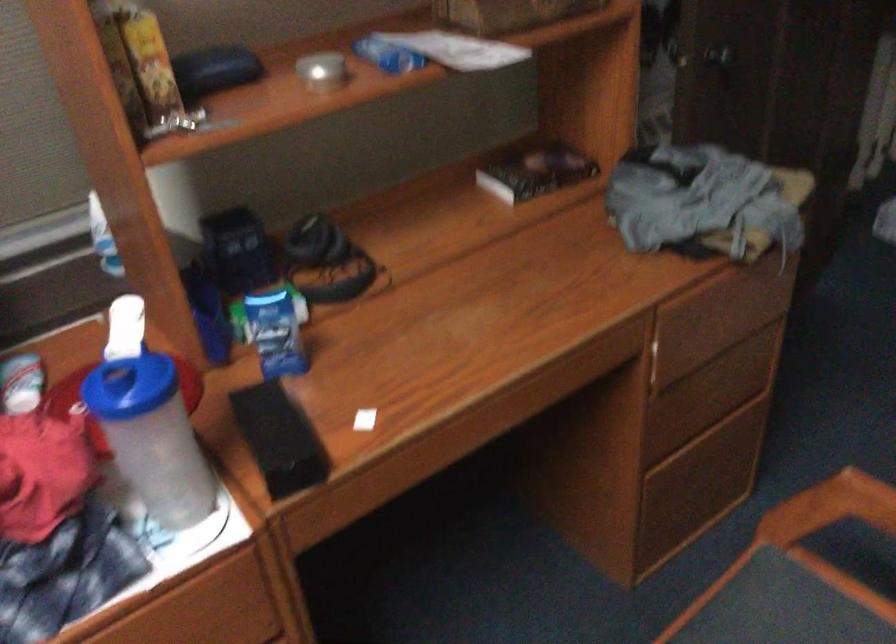
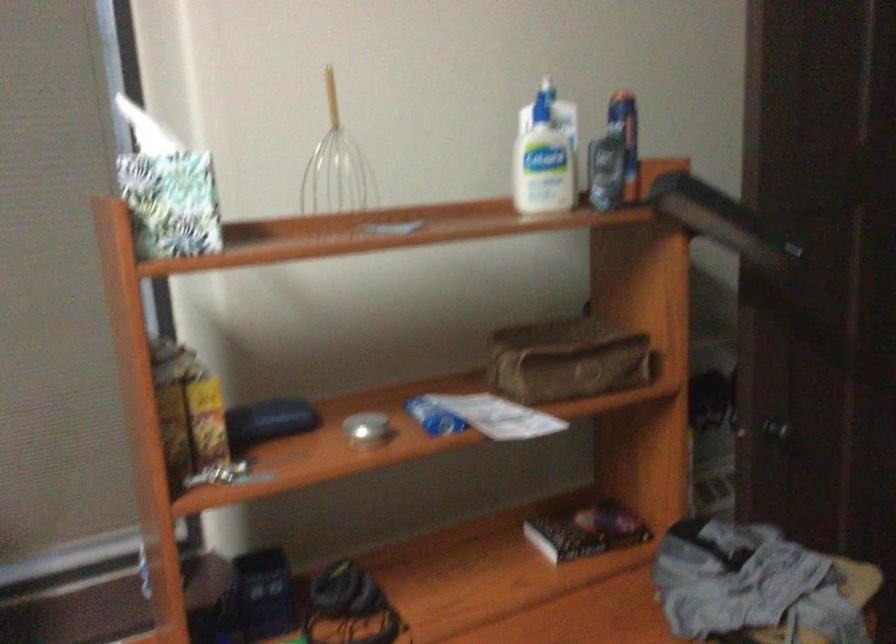
Question: The images are taken continuously from a first-person perspective. In which direction is your viewpoint rotating?

Choices:
 (A) Left
 (B) Right
 (C) Up
 (D) Down

Answer: (C)